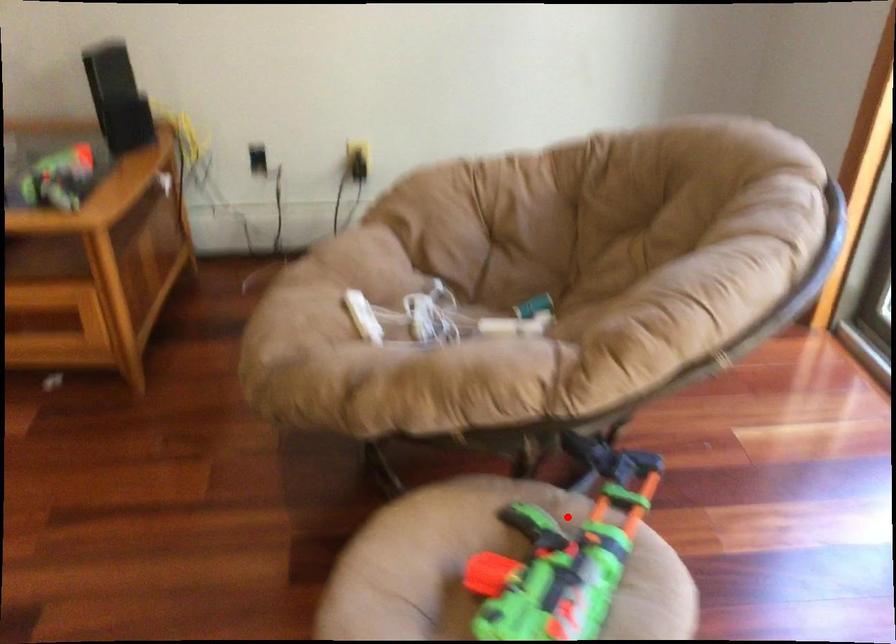
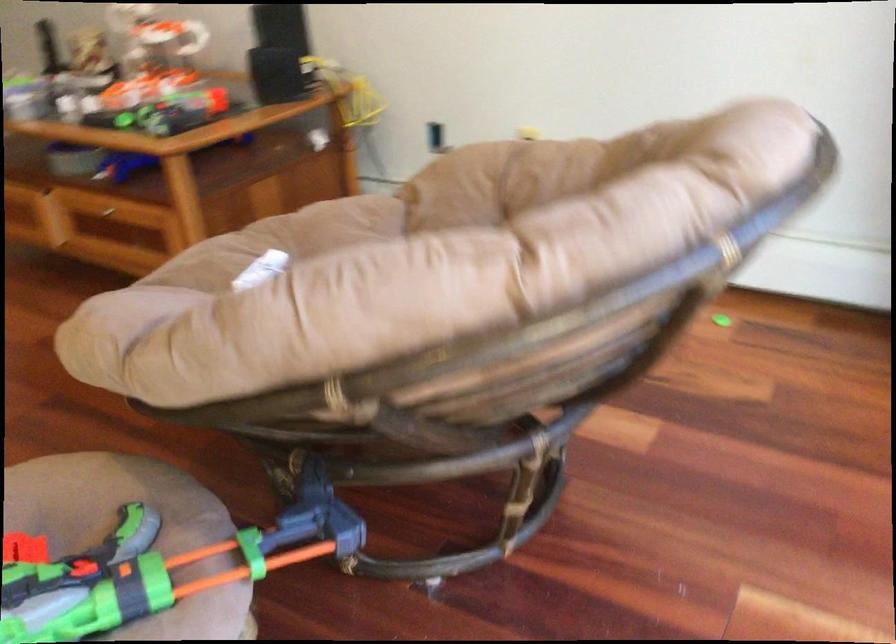
Question: I am providing you with two images of the same scene from different viewpoints. Image1 has a red point marked. In image2, the corresponding 3D location appears at what relative position? Reply with the corresponding letter.

Choices:
 (A) Closer
 (B) Farther

Answer: (A)